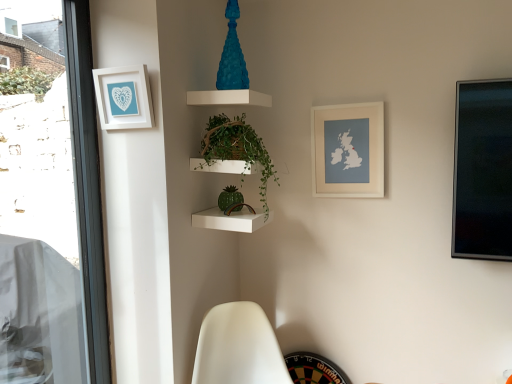
Question: Is green glossy plant at center positioned with its back to white matte swivel chair at lower center?

Choices:
 (A) no
 (B) yes

Answer: (A)

Question: Does green glossy plant at center have a larger size compared to white matte swivel chair at lower center?

Choices:
 (A) yes
 (B) no

Answer: (B)

Question: From a real-world perspective, does green glossy plant at center sit lower than white matte swivel chair at lower center?

Choices:
 (A) yes
 (B) no

Answer: (B)

Question: Is green glossy plant at center wider than white matte swivel chair at lower center?

Choices:
 (A) yes
 (B) no

Answer: (B)

Question: Is green glossy plant at center to the right of white matte swivel chair at lower center from the viewer's perspective?

Choices:
 (A) yes
 (B) no

Answer: (B)

Question: From a real-world perspective, is white matte swivel chair at lower center above or below white matte picture frame at upper left, the 2th picture frame from the back?

Choices:
 (A) above
 (B) below

Answer: (B)

Question: Is point (209, 329) positioned closer to the camera than point (141, 64)?

Choices:
 (A) farther
 (B) closer

Answer: (A)

Question: Considering the positions of white matte swivel chair at lower center and white matte picture frame at upper left, the 2th picture frame from the back, in the image, is white matte swivel chair at lower center wider or thinner than white matte picture frame at upper left, the 2th picture frame from the back,?

Choices:
 (A) thin
 (B) wide

Answer: (B)

Question: From their relative heights in the image, would you say white matte swivel chair at lower center is taller or shorter than white matte picture frame at upper left, the 2th picture frame from the back?

Choices:
 (A) short
 (B) tall

Answer: (B)

Question: In terms of width, does white matte swivel chair at lower center look wider or thinner when compared to white matte map at upper right, marked as the 1th picture frame in a back-to-front arrangement?

Choices:
 (A) thin
 (B) wide

Answer: (B)

Question: Is white matte swivel chair at lower center inside or outside of white matte map at upper right, positioned as the 2th picture frame in left-to-right order?

Choices:
 (A) outside
 (B) inside

Answer: (A)

Question: Considering their positions, is white matte swivel chair at lower center located in front of or behind white matte map at upper right, placed as the first picture frame when sorted from right to left?

Choices:
 (A) front
 (B) behind

Answer: (A)

Question: From their relative heights in the image, would you say white matte swivel chair at lower center is taller or shorter than white matte map at upper right, which is the 2th picture frame in front-to-back order?

Choices:
 (A) short
 (B) tall

Answer: (B)

Question: Is white matte picture frame at upper left, the 1th picture frame from the front, taller or shorter than white matte map at upper right, marked as the 1th picture frame in a back-to-front arrangement?

Choices:
 (A) short
 (B) tall

Answer: (A)

Question: From a real-world perspective, relative to white matte map at upper right, placed as the first picture frame when sorted from right to left, is white matte picture frame at upper left, the 2th picture frame from the back, vertically above or below?

Choices:
 (A) below
 (B) above

Answer: (B)